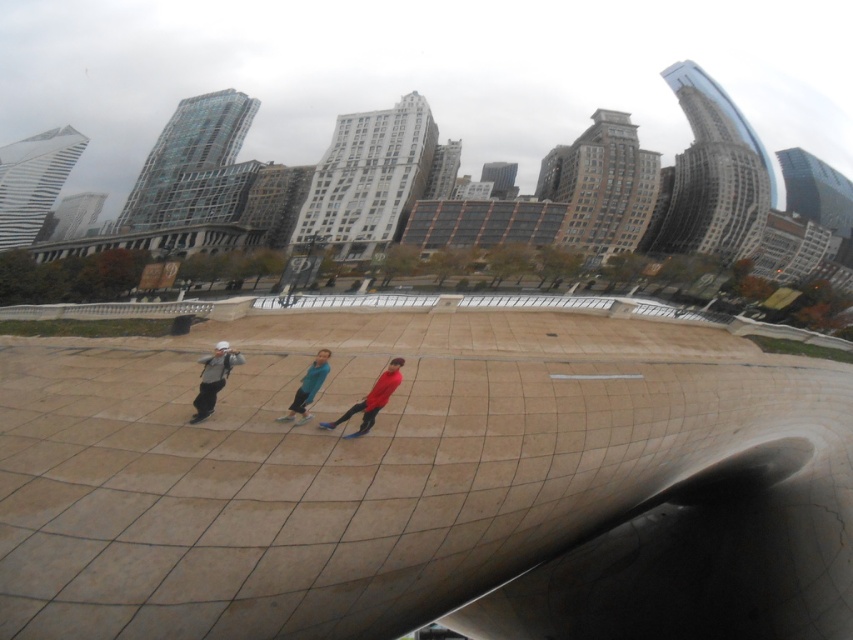
How distant is matte gray jacket at center from blue fabric pants at center?

matte gray jacket at center is 3.73 meters away from blue fabric pants at center.

Can you confirm if matte gray jacket at center is taller than blue fabric pants at center?

Yes, matte gray jacket at center is taller than blue fabric pants at center.

Is point (213, 404) more distant than point (305, 404)?

No, it is not.

I want to click on matte gray jacket at center, so click(213, 378).

Is matte gray jacket at center to the right of matte red jacket at center from the viewer's perspective?

Incorrect, matte gray jacket at center is not on the right side of matte red jacket at center.

The image size is (853, 640). What do you see at coordinates (213, 378) in the screenshot?
I see `matte gray jacket at center` at bounding box center [213, 378].

This screenshot has width=853, height=640. I want to click on matte gray jacket at center, so click(x=213, y=378).

Does matte red jacket at center appear over blue fabric pants at center?

Actually, matte red jacket at center is below blue fabric pants at center.

Who is taller, matte red jacket at center or blue fabric pants at center?

blue fabric pants at center is taller.

Does point (363, 428) come closer to viewer compared to point (322, 365)?

That is True.

Locate an element on the screen. The image size is (853, 640). matte red jacket at center is located at coordinates (370, 400).